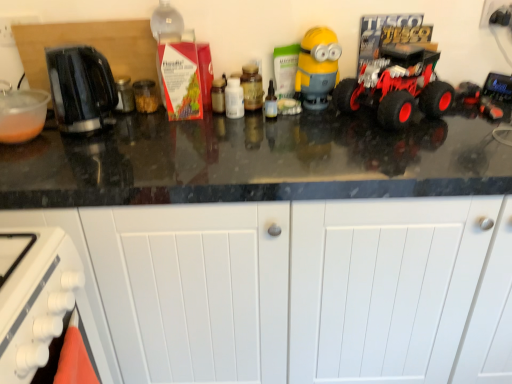
Question: From the image's perspective, is black plastic toaster at left on top of white matte cabinet at lower center?

Choices:
 (A) no
 (B) yes

Answer: (B)

Question: Considering the relative sizes of black plastic toaster at left and white matte cabinet at lower center in the image provided, is black plastic toaster at left taller than white matte cabinet at lower center?

Choices:
 (A) no
 (B) yes

Answer: (A)

Question: From the image's perspective, is black plastic toaster at left under white matte cabinet at lower center?

Choices:
 (A) no
 (B) yes

Answer: (A)

Question: Is black plastic toaster at left to the right of white matte cabinet at lower center from the viewer's perspective?

Choices:
 (A) yes
 (B) no

Answer: (B)

Question: Can you confirm if black plastic toaster at left is bigger than white matte cabinet at lower center?

Choices:
 (A) no
 (B) yes

Answer: (A)

Question: Does black plastic toaster at left come in front of white matte cabinet at lower center?

Choices:
 (A) yes
 (B) no

Answer: (B)

Question: Considering the relative sizes of matte brown jar at center, placed as the 2th bottle when sorted from left to right, and white matte cabinet at lower center in the image provided, is matte brown jar at center, placed as the 2th bottle when sorted from left to right, shorter than white matte cabinet at lower center?

Choices:
 (A) yes
 (B) no

Answer: (A)

Question: Does matte brown jar at center, which is the second bottle from right to left, have a lesser width compared to white matte cabinet at lower center?

Choices:
 (A) no
 (B) yes

Answer: (B)

Question: Are matte brown jar at center, which is the second bottle from right to left, and white matte cabinet at lower center making contact?

Choices:
 (A) yes
 (B) no

Answer: (B)

Question: From a real-world perspective, is matte brown jar at center, which is the second bottle from right to left, physically above white matte cabinet at lower center?

Choices:
 (A) no
 (B) yes

Answer: (B)

Question: Is the depth of matte brown jar at center, which is the second bottle from right to left, greater than that of white matte cabinet at lower center?

Choices:
 (A) yes
 (B) no

Answer: (A)

Question: Is white matte cabinet at lower center located within matte brown jar at center, which is the second bottle from right to left?

Choices:
 (A) no
 (B) yes

Answer: (A)

Question: From the image's perspective, is rubberized red truck at right beneath transparent glass bottle at center, acting as the 3th bottle starting from the left?

Choices:
 (A) yes
 (B) no

Answer: (B)